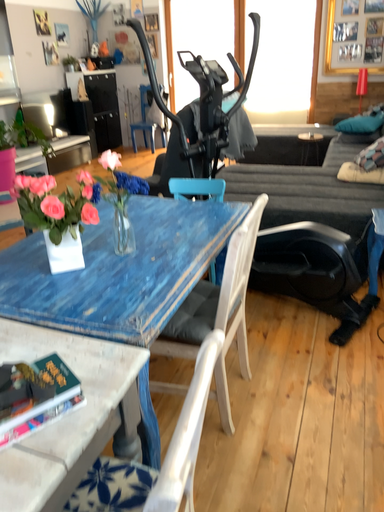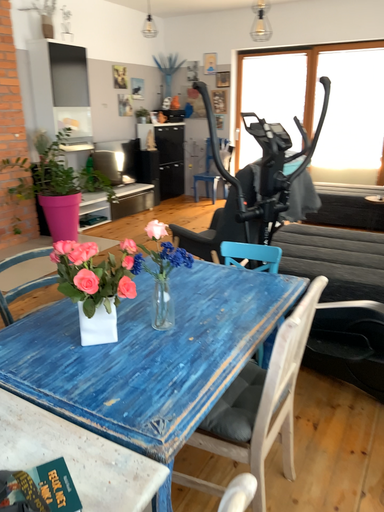
Question: How did the camera likely rotate when shooting the video?

Choices:
 (A) rotated downward
 (B) rotated upward

Answer: (B)